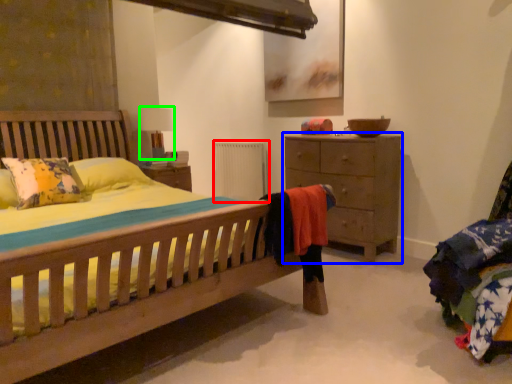
Question: Based on their relative distances, which object is farther from radiator (highlighted by a red box)? Choose from chest of drawers (highlighted by a blue box) and table lamp (highlighted by a green box).

Choices:
 (A) chest of drawers
 (B) table lamp

Answer: (A)